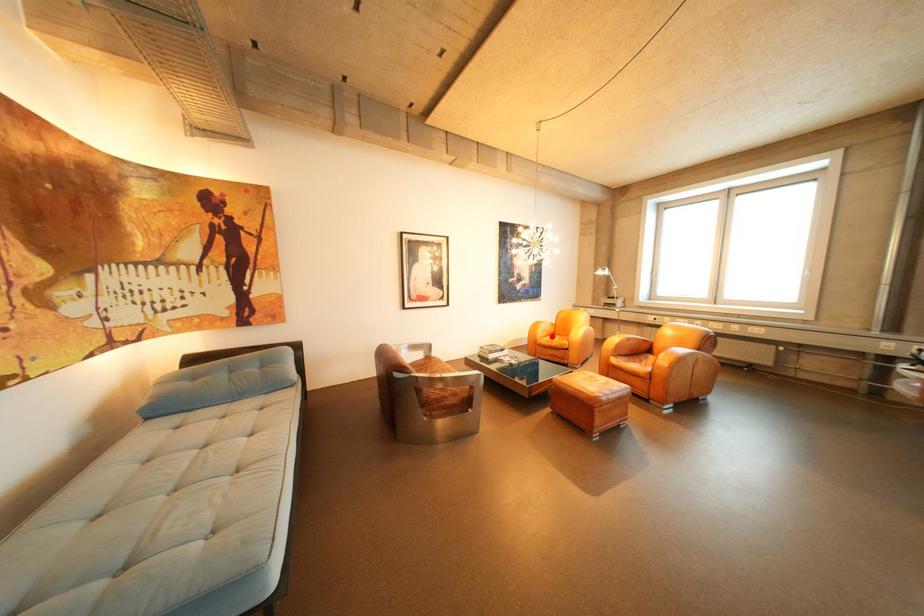
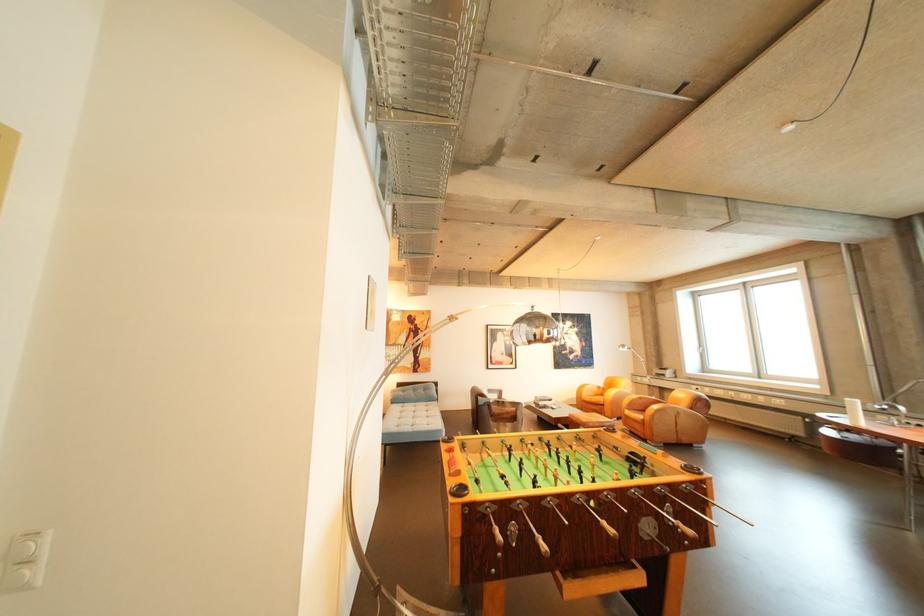
In the second image, find the point that corresponds to the highlighted location in the first image.

(598, 395)